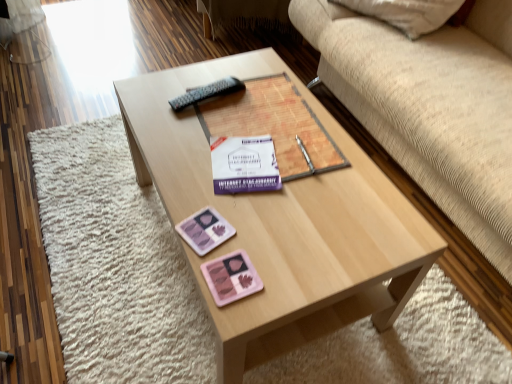
What do you see at coordinates (281, 223) in the screenshot?
I see `light wood coffee table at center` at bounding box center [281, 223].

I want to click on white paper at center, so click(244, 165).

Measure the distance between point (220, 225) and camera.

Point (220, 225) and camera are 38.43 inches apart from each other.

How much space does pink matte eyeshadow palette at center, arranged as the 1th currency when viewed from the top, occupy horizontally?

It is 4.52 inches.

The height and width of the screenshot is (384, 512). What do you see at coordinates (431, 107) in the screenshot? I see `beige fabric couch at upper right` at bounding box center [431, 107].

Image resolution: width=512 pixels, height=384 pixels. In order to click on light wood coffee table at center in this screenshot , I will do `click(281, 223)`.

Where is `book lying in front of the white paper at center`? This screenshot has height=384, width=512. book lying in front of the white paper at center is located at coordinates (274, 125).

Considering the positions of objects purple matte book at center and white paper at center in the image provided, who is more to the left, purple matte book at center or white paper at center?

Positioned to the left is white paper at center.

Is there a large distance between purple matte book at center and white paper at center?

That's not correct — purple matte book at center is a little close to white paper at center.

Is purple matte book at center turned away from white paper at center?

purple matte book at center does not have its back to white paper at center.

Is light wood coffee table at center taller than pink matte eyeshadow palette at lower center, which is the second currency from top to bottom?

Indeed, light wood coffee table at center has a greater height compared to pink matte eyeshadow palette at lower center, which is the second currency from top to bottom.

Is light wood coffee table at center positioned behind pink matte eyeshadow palette at lower center, which is the 1th currency from bottom to top?

No.

From the image's perspective, is pink matte eyeshadow palette at center, arranged as the second currency when ordered from the bottom, located above or below white paper at center?

Clearly, from the image's perspective, pink matte eyeshadow palette at center, arranged as the second currency when ordered from the bottom, is below white paper at center.

You are a GUI agent. You are given a task and a screenshot of the screen. Output one action in this format:
    pyautogui.click(x=<x>, y=<y>)
    Task: Click on the paperback book above the pink matte eyeshadow palette at center, arranged as the second currency when ordered from the bottom (from a real-world perspective)
    
    Given the screenshot: What is the action you would take?
    pyautogui.click(x=244, y=165)

Relative to white paper at center, is pink matte eyeshadow palette at center, arranged as the second currency when ordered from the bottom, in front or behind?

pink matte eyeshadow palette at center, arranged as the second currency when ordered from the bottom, is in front of white paper at center.

Considering the relative sizes of pink matte eyeshadow palette at center, arranged as the second currency when ordered from the bottom, and white paper at center in the image provided, is pink matte eyeshadow palette at center, arranged as the second currency when ordered from the bottom, bigger than white paper at center?

No, pink matte eyeshadow palette at center, arranged as the second currency when ordered from the bottom, is not bigger than white paper at center.

Considering the relative positions of white paper at center and pink matte eyeshadow palette at lower center, which is the second currency from top to bottom, in the image provided, is white paper at center to the right of pink matte eyeshadow palette at lower center, which is the second currency from top to bottom, from the viewer's perspective?

Yes, white paper at center is to the right of pink matte eyeshadow palette at lower center, which is the second currency from top to bottom.

From a real-world perspective, which object rests below the other?

white paper at center.

Which of these two, white paper at center or pink matte eyeshadow palette at lower center, which is the second currency from top to bottom, is thinner?

pink matte eyeshadow palette at lower center, which is the second currency from top to bottom, is thinner.

This screenshot has height=384, width=512. Find the location of `paperback book above the pink matte eyeshadow palette at lower center, which is the second currency from top to bottom (from the image's perspective)`. paperback book above the pink matte eyeshadow palette at lower center, which is the second currency from top to bottom (from the image's perspective) is located at coordinates (244, 165).

From a real-world perspective, relative to pink matte eyeshadow palette at center, arranged as the second currency when ordered from the bottom, is white paper at center vertically above or below?

white paper at center is situated higher than pink matte eyeshadow palette at center, arranged as the second currency when ordered from the bottom, in the real world.

Looking at this image, measure the distance from white paper at center to pink matte eyeshadow palette at center, arranged as the second currency when ordered from the bottom.

They are 16.42 centimeters apart.

Who is smaller, white paper at center or pink matte eyeshadow palette at center, arranged as the 1th currency when viewed from the top?

pink matte eyeshadow palette at center, arranged as the 1th currency when viewed from the top, is smaller.

Does white paper at center have a lesser width compared to pink matte eyeshadow palette at center, arranged as the 1th currency when viewed from the top?

Incorrect, the width of white paper at center is not less than that of pink matte eyeshadow palette at center, arranged as the 1th currency when viewed from the top.

I want to click on studio couch lying above the light wood coffee table at center (from the image's perspective), so click(431, 107).

Is light wood coffee table at center positioned with its back to beige fabric couch at upper right?

That's not correct — light wood coffee table at center is not looking away from beige fabric couch at upper right.

Considering the sizes of objects light wood coffee table at center and beige fabric couch at upper right in the image provided, who is bigger, light wood coffee table at center or beige fabric couch at upper right?

beige fabric couch at upper right is bigger.

Is light wood coffee table at center inside the boundaries of beige fabric couch at upper right, or outside?

light wood coffee table at center is located beyond the bounds of beige fabric couch at upper right.

Does pink matte eyeshadow palette at center, arranged as the 1th currency when viewed from the top, appear on the left side of beige fabric couch at upper right?

Yes.

Between pink matte eyeshadow palette at center, arranged as the 1th currency when viewed from the top, and beige fabric couch at upper right, which one has larger size?

With larger size is beige fabric couch at upper right.

Who is more distant, pink matte eyeshadow palette at center, arranged as the second currency when ordered from the bottom, or beige fabric couch at upper right?

Positioned behind is pink matte eyeshadow palette at center, arranged as the second currency when ordered from the bottom.

From a real-world perspective, who is located lower, pink matte eyeshadow palette at center, arranged as the second currency when ordered from the bottom, or beige fabric couch at upper right?

From a 3D spatial view, beige fabric couch at upper right is below.

Identify the location of paperback book below the purple matte book at center (from a real-world perspective). This screenshot has height=384, width=512. (244, 165).

From the image's perspective, count 2nd currencys downward from the light wood coffee table at center and point to it. Please provide its 2D coordinates.

[(231, 278)]

Based on the photo, estimate the real-world distances between objects in this image. Which object is closer to white paper at center, pink matte eyeshadow palette at center, arranged as the 1th currency when viewed from the top, or pink matte eyeshadow palette at lower center, which is the 1th currency from bottom to top?

pink matte eyeshadow palette at center, arranged as the 1th currency when viewed from the top, lies closer to white paper at center than the other object.

Which object lies nearer to the anchor point pink matte eyeshadow palette at lower center, which is the second currency from top to bottom, light wood coffee table at center or white paper at center?

white paper at center is closer to pink matte eyeshadow palette at lower center, which is the second currency from top to bottom.

Estimate the real-world distances between objects in this image. Which object is further from beige fabric couch at upper right, pink matte eyeshadow palette at lower center, which is the 1th currency from bottom to top, or pink matte eyeshadow palette at center, arranged as the second currency when ordered from the bottom?

pink matte eyeshadow palette at lower center, which is the 1th currency from bottom to top, is further to beige fabric couch at upper right.

Consider the image. When comparing their distances from pink matte eyeshadow palette at lower center, which is the 1th currency from bottom to top, does beige fabric couch at upper right or pink matte eyeshadow palette at center, arranged as the 1th currency when viewed from the top, seem further?

beige fabric couch at upper right.

From the image, which object appears to be nearer to purple matte book at center, pink matte eyeshadow palette at lower center, which is the second currency from top to bottom, or pink matte eyeshadow palette at center, arranged as the 1th currency when viewed from the top?

pink matte eyeshadow palette at center, arranged as the 1th currency when viewed from the top, is positioned closer to the anchor purple matte book at center.

Considering their positions, is light wood coffee table at center positioned further to purple matte book at center than pink matte eyeshadow palette at center, arranged as the second currency when ordered from the bottom?

Among the two, pink matte eyeshadow palette at center, arranged as the second currency when ordered from the bottom, is located further to purple matte book at center.

Looking at this image, from the image, which object appears to be nearer to purple matte book at center, white paper at center or pink matte eyeshadow palette at center, arranged as the 1th currency when viewed from the top?

white paper at center.

From the image, which object appears to be nearer to pink matte eyeshadow palette at lower center, which is the 1th currency from bottom to top, beige fabric couch at upper right or purple matte book at center?

Based on the image, purple matte book at center appears to be nearer to pink matte eyeshadow palette at lower center, which is the 1th currency from bottom to top.

Find the location of a particular element. The image size is (512, 384). book between white paper at center and beige fabric couch at upper right is located at coordinates (274, 125).

This screenshot has width=512, height=384. I want to click on paperback book between purple matte book at center and pink matte eyeshadow palette at lower center, which is the 1th currency from bottom to top, in the vertical direction, so click(x=244, y=165).

What are the coordinates of `paperback book between pink matte eyeshadow palette at center, arranged as the second currency when ordered from the bottom, and beige fabric couch at upper right, in the horizontal direction` in the screenshot? It's located at (244, 165).

Image resolution: width=512 pixels, height=384 pixels. I want to click on book between pink matte eyeshadow palette at center, arranged as the 1th currency when viewed from the top, and beige fabric couch at upper right, so click(274, 125).